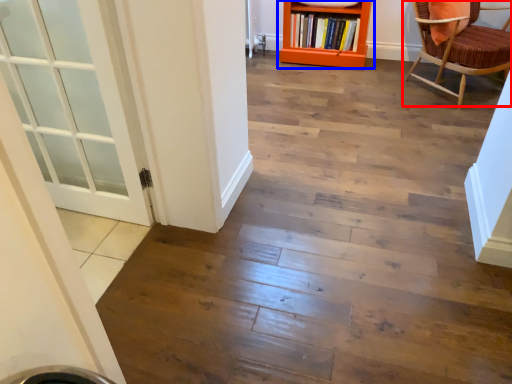
Question: Which object appears closest to the camera in this image, chair (highlighted by a red box) or bookcase (highlighted by a blue box)?

Choices:
 (A) chair
 (B) bookcase

Answer: (A)